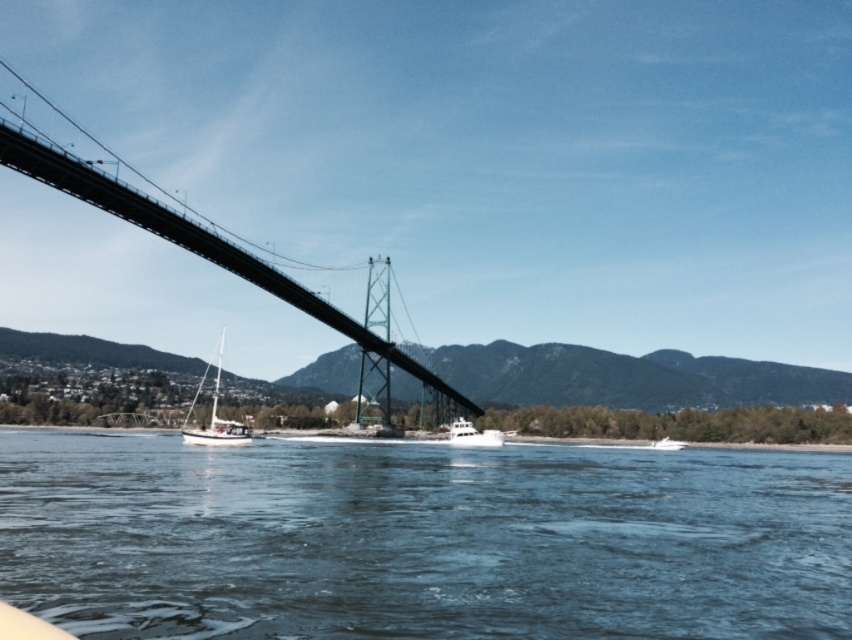
Question: Which object is the closest to the blue water at center?

Choices:
 (A) white matte boat at center
 (B) white matte sailboat at lower left

Answer: (A)

Question: Considering the relative positions of blue water at center and white matte sailboat at lower left in the image provided, where is blue water at center located with respect to white matte sailboat at lower left?

Choices:
 (A) right
 (B) left

Answer: (A)

Question: Which of the following is the closest to the observer?

Choices:
 (A) white matte boat at center
 (B) white matte sailboat at lower left
 (C) blue water at center
 (D) green metallic suspension bridge at center

Answer: (C)

Question: Can you confirm if green metallic suspension bridge at center is wider than white matte boat at center?

Choices:
 (A) no
 (B) yes

Answer: (B)

Question: Can you confirm if blue water at center is smaller than white matte boat at center?

Choices:
 (A) no
 (B) yes

Answer: (A)

Question: Estimate the real-world distances between objects in this image. Which object is farther from the blue water at center?

Choices:
 (A) green metallic suspension bridge at center
 (B) white matte sailboat at lower left
 (C) white matte boat at center

Answer: (A)